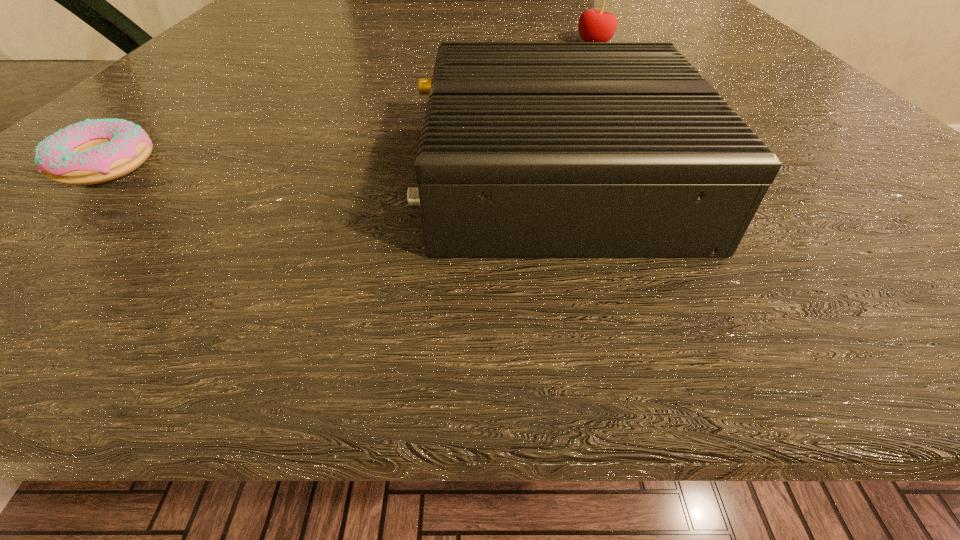
The width and height of the screenshot is (960, 540). What are the coordinates of `object present at the near edge` in the screenshot? It's located at (528, 149).

Locate an element on the screen. This screenshot has width=960, height=540. object located at the left edge is located at coordinates (95, 151).

This screenshot has width=960, height=540. I want to click on vacant space at the far edge, so click(x=458, y=2).

The width and height of the screenshot is (960, 540). Identify the location of free space at the near edge of the desktop. pos(777,228).

Find the location of a particular element. This screenshot has height=540, width=960. vacant space at the left edge of the desktop is located at coordinates [295, 33].

In the image, there is a desktop. Identify the location of vacant space at the right edge. Image resolution: width=960 pixels, height=540 pixels. (884, 217).

The height and width of the screenshot is (540, 960). I want to click on free region at the far left corner, so click(297, 8).

At what (x,y) coordinates should I click in order to perform the action: click on free spot at the near right corner of the desktop. Please return your answer as a coordinate pair (x, y). The image size is (960, 540). Looking at the image, I should click on tap(854, 237).

Where is `vacant point located between the shortest object and the router`? This screenshot has height=540, width=960. vacant point located between the shortest object and the router is located at coordinates (331, 172).

Locate an element on the screen. Image resolution: width=960 pixels, height=540 pixels. free space between the tallest object and the leftmost object is located at coordinates (350, 105).